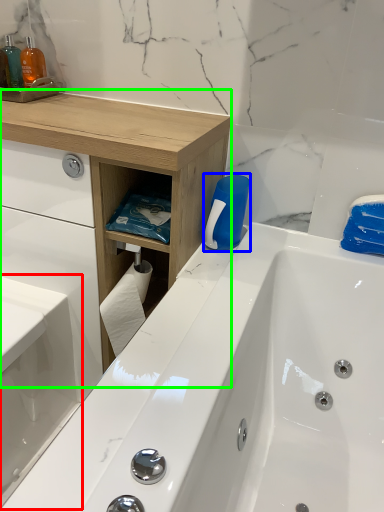
Question: Estimate the real-world distances between objects in this image. Which object is closer to sink (highlighted by a red box), cleaning product (highlighted by a blue box) or counter (highlighted by a green box)?

Choices:
 (A) cleaning product
 (B) counter

Answer: (B)